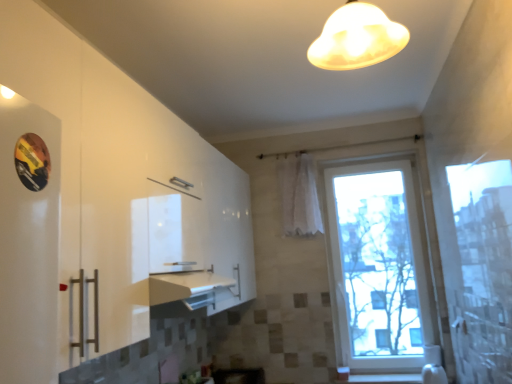
Question: Are matte glass lampshade at upper center and transparent glass window at center making contact?

Choices:
 (A) no
 (B) yes

Answer: (A)

Question: Is matte glass lampshade at upper center positioned behind transparent glass window at center?

Choices:
 (A) yes
 (B) no

Answer: (B)

Question: Can you confirm if matte glass lampshade at upper center is bigger than transparent glass window at center?

Choices:
 (A) no
 (B) yes

Answer: (A)

Question: From a real-world perspective, is matte glass lampshade at upper center positioned over transparent glass window at center based on gravity?

Choices:
 (A) no
 (B) yes

Answer: (B)

Question: Considering the relative positions of matte glass lampshade at upper center and transparent glass window at center in the image provided, is matte glass lampshade at upper center in front of transparent glass window at center?

Choices:
 (A) no
 (B) yes

Answer: (B)

Question: Which is correct: matte glass lampshade at upper center is inside transparent glass window at center, or outside of it?

Choices:
 (A) outside
 (B) inside

Answer: (A)

Question: Considering the positions of matte glass lampshade at upper center and transparent glass window at center in the image, is matte glass lampshade at upper center wider or thinner than transparent glass window at center?

Choices:
 (A) thin
 (B) wide

Answer: (B)

Question: Based on their sizes in the image, would you say matte glass lampshade at upper center is bigger or smaller than transparent glass window at center?

Choices:
 (A) big
 (B) small

Answer: (B)

Question: In the image, is matte glass lampshade at upper center on the left side or the right side of transparent glass window at center?

Choices:
 (A) right
 (B) left

Answer: (B)

Question: From a real-world perspective, is transparent glass window at center above or below matte glass lampshade at upper center?

Choices:
 (A) above
 (B) below

Answer: (B)

Question: Considering the positions of point (354, 263) and point (388, 54), is point (354, 263) closer or farther from the camera than point (388, 54)?

Choices:
 (A) closer
 (B) farther

Answer: (B)

Question: Looking at the image, does transparent glass window at center seem bigger or smaller compared to matte glass lampshade at upper center?

Choices:
 (A) small
 (B) big

Answer: (B)

Question: In the image, is transparent glass window at center positioned in front of or behind matte glass lampshade at upper center?

Choices:
 (A) front
 (B) behind

Answer: (B)

Question: From a real-world perspective, relative to matte glass lampshade at upper center, is white sheer curtain at center vertically above or below?

Choices:
 (A) below
 (B) above

Answer: (A)

Question: Is white sheer curtain at center in front of or behind matte glass lampshade at upper center in the image?

Choices:
 (A) behind
 (B) front

Answer: (A)